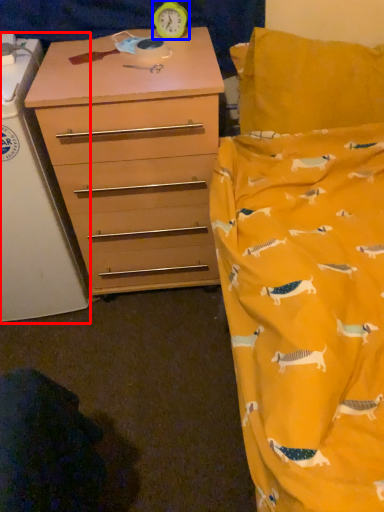
Question: Which object is further to the camera taking this photo, changing table (highlighted by a red box) or clock (highlighted by a blue box)?

Choices:
 (A) changing table
 (B) clock

Answer: (B)